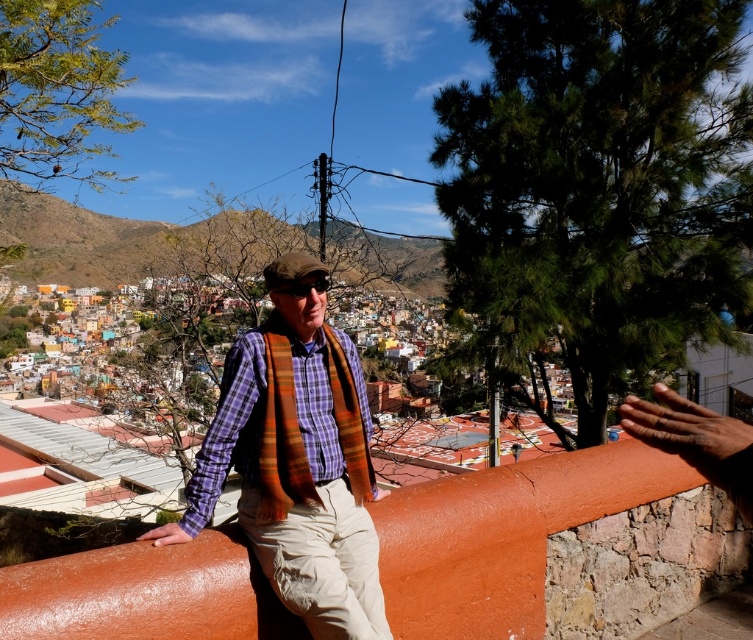
In the scene shown: You are standing at the same vantage point as the man in the image. You want to take a photo of the town while also including both the plaid fabric shirt at center and the orange rough stone wall at center in the frame. Which object should be positioned to the left in your photo?

The plaid fabric shirt at center should be positioned to the left of the orange rough stone wall at center in your photo because the plaid fabric shirt at center is to the left of orange rough stone wall at center.

You are standing at the top of a hill overlooking a town. You see a plaid fabric shirt at center and a camera. Which object is closer to you?

The plaid fabric shirt at center is closer to you than the camera because the distance between them is 175.01 feet.